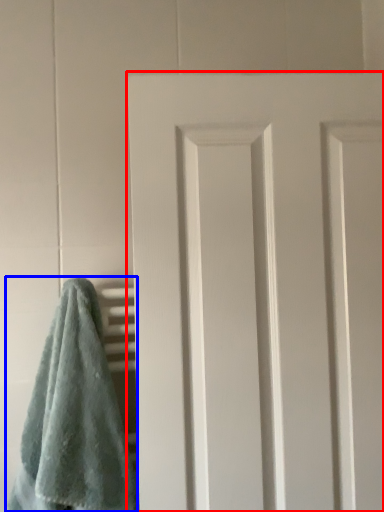
Question: Which object is closer to the camera taking this photo, door (highlighted by a red box) or towel (highlighted by a blue box)?

Choices:
 (A) door
 (B) towel

Answer: (B)